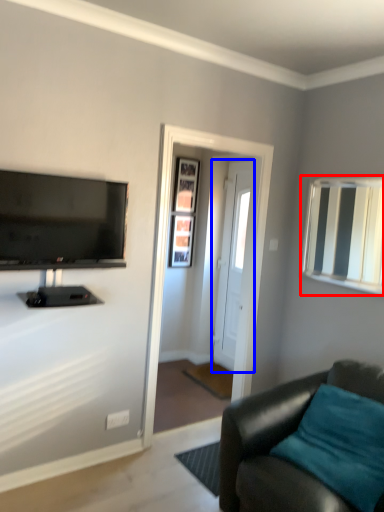
Question: Which object is further to the camera taking this photo, mirror (highlighted by a red box) or door (highlighted by a blue box)?

Choices:
 (A) mirror
 (B) door

Answer: (B)